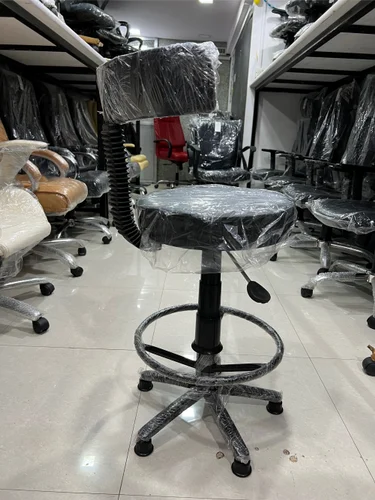
Identify the location of circle under chair. This screenshot has height=500, width=375. (272, 357).